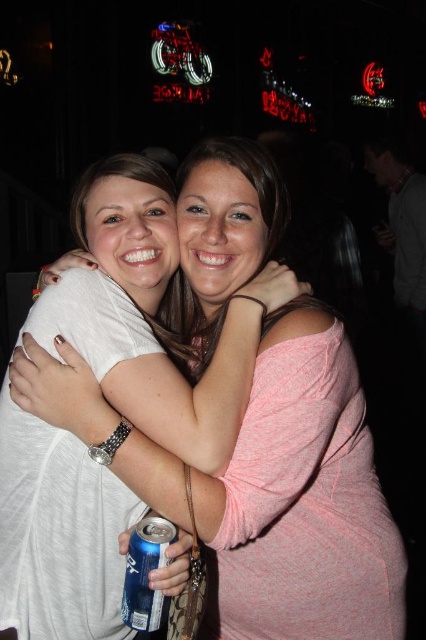
You are a photographer adjusting the focus of your camera. You notice the pink fabric shirt at center and the blue metallic can at lower center in your viewfinder. Which object should you focus on first if you want to capture the larger object in sharp detail?

You should focus on the pink fabric shirt at center first because it has a larger size compared to the blue metallic can at lower center, making it the bigger object to prioritize.

You are a photographer setting up a shot of the scene described. You need to ensure that the pink fabric shirt at center and the blue metallic can at lower center are both in focus. Given their sizes, which object requires a closer focus adjustment to capture its details accurately?

The blue metallic can at lower center requires closer focus adjustment because it is smaller in width compared to the pink fabric shirt at center, which is wider. Smaller objects often need to be focused more precisely to capture details.